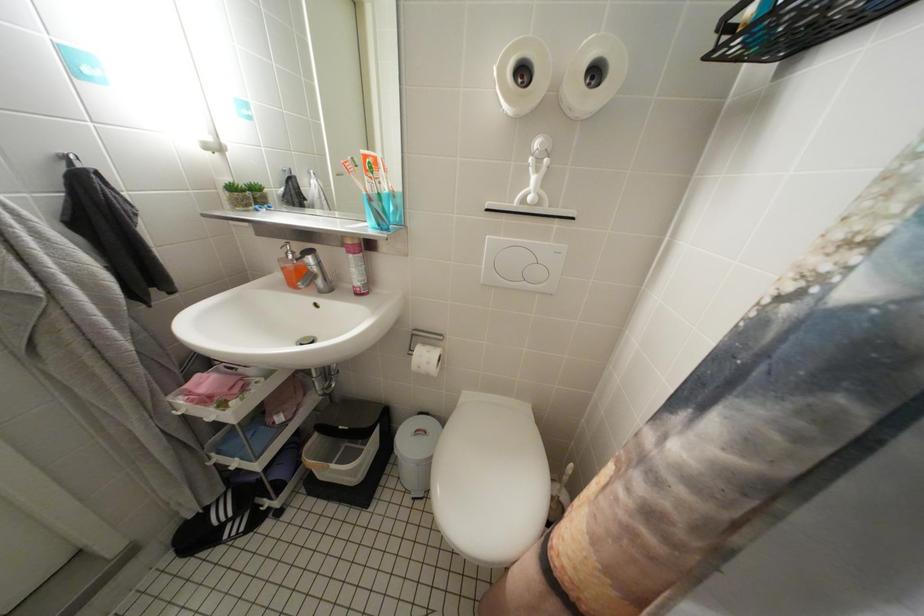
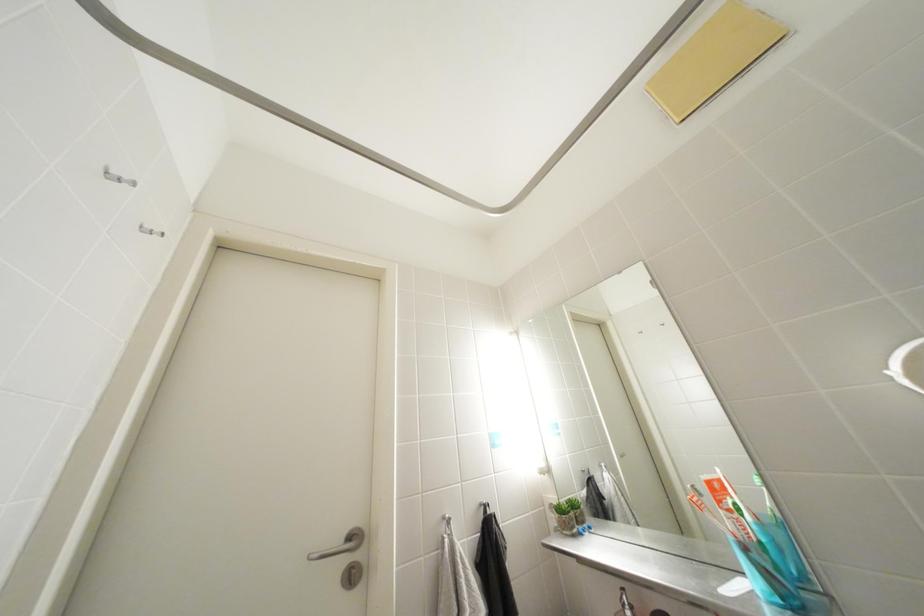
Based on the continuous images, in which direction is the camera rotating?

The camera's rotation is toward left-up.